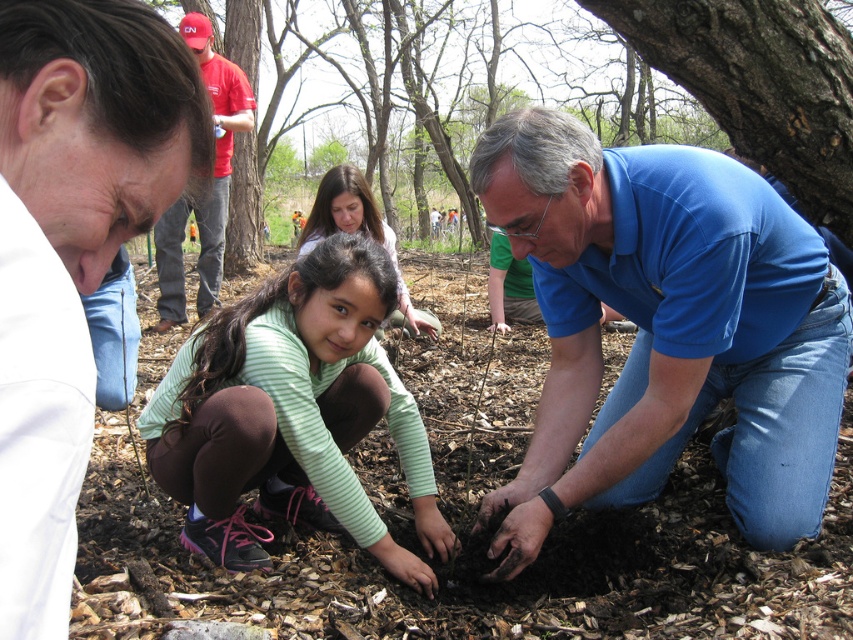
Question: Is smooth bark tree at upper right below light green striped shirt at center?

Choices:
 (A) yes
 (B) no

Answer: (B)

Question: Which point is closer to the camera?

Choices:
 (A) red cotton shirt at upper left
 (B) light green striped shirt at center
 (C) blue cotton shirt at lower right
 (D) green striped shirt at center

Answer: (C)

Question: Is blue cotton shirt at lower right thinner than light green striped shirt at center?

Choices:
 (A) no
 (B) yes

Answer: (A)

Question: Which of these objects is positioned closest to the green striped shirt at center?

Choices:
 (A) smooth bark tree at upper right
 (B) light green striped shirt at center
 (C) red cotton shirt at upper left

Answer: (B)

Question: Does blue cotton shirt at lower right have a larger size compared to red cotton shirt at upper left?

Choices:
 (A) no
 (B) yes

Answer: (A)

Question: Which point is farther to the camera?

Choices:
 (A) smooth bark tree at upper right
 (B) red cotton shirt at upper left

Answer: (B)